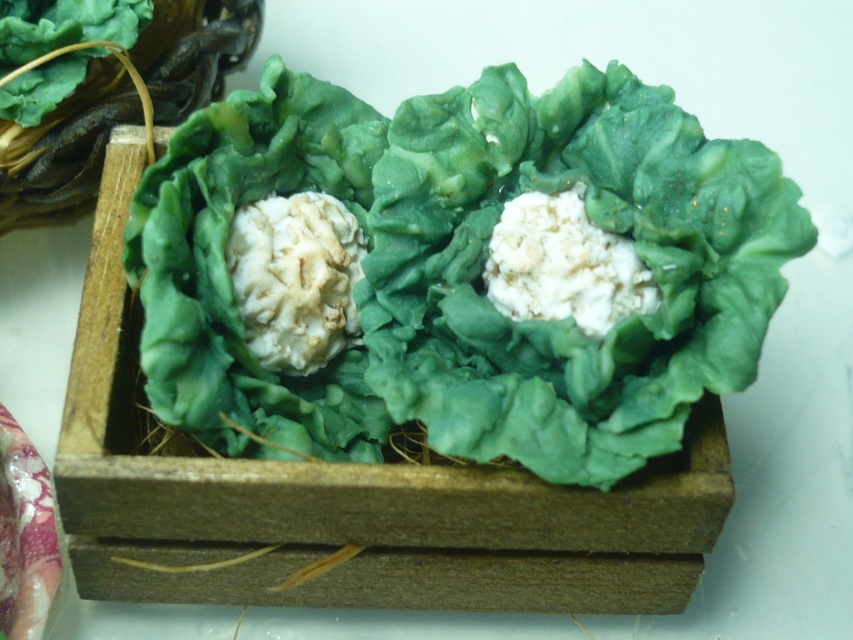
Does green matte lettuce at center come behind white crumbly food at center?

No.

Consider the image. Can you confirm if green matte lettuce at center is positioned to the left of white crumbly food at center?

In fact, green matte lettuce at center is to the right of white crumbly food at center.

Locate an element on the screen. This screenshot has width=853, height=640. green matte lettuce at center is located at coordinates (457, 272).